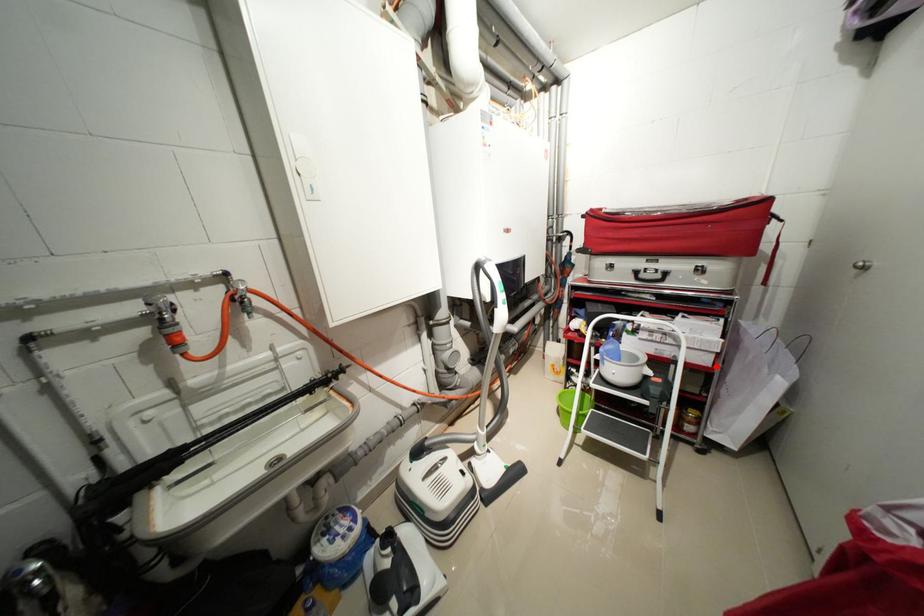
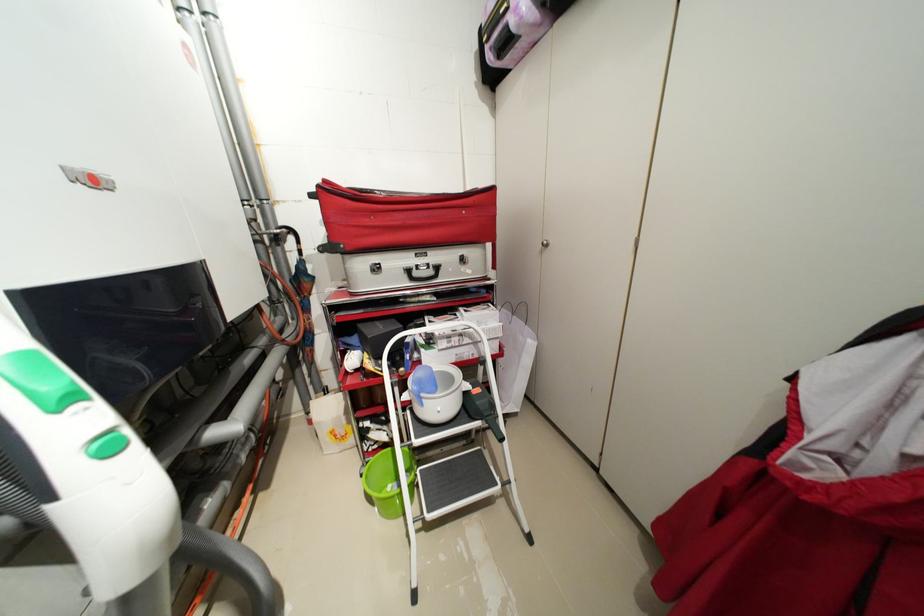
Locate, in the second image, the point that corresponds to the highlighted location in the first image.

(505, 352)